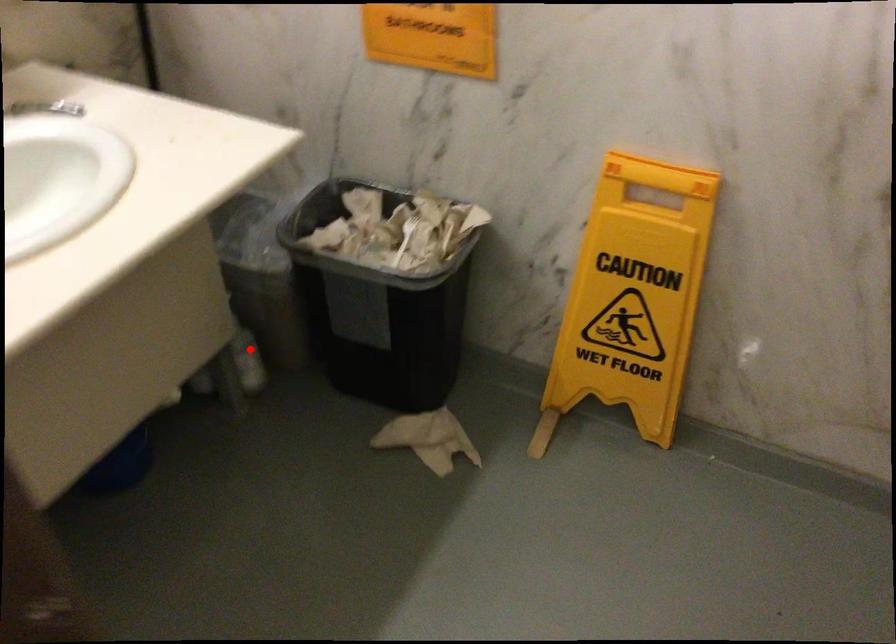
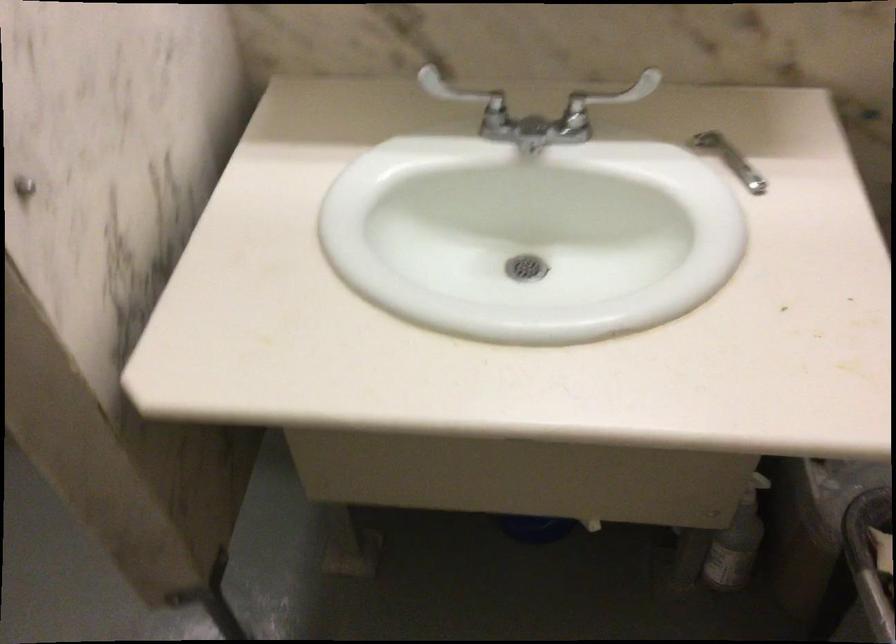
The point at the highlighted location is marked in the first image. Where is the corresponding point in the second image?

(737, 542)